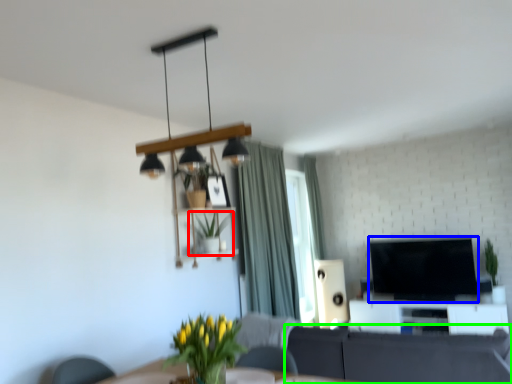
Question: Based on their relative distances, which object is farther from houseplant (highlighted by a red box)? Choose from television (highlighted by a blue box) and studio couch (highlighted by a green box).

Choices:
 (A) television
 (B) studio couch

Answer: (A)